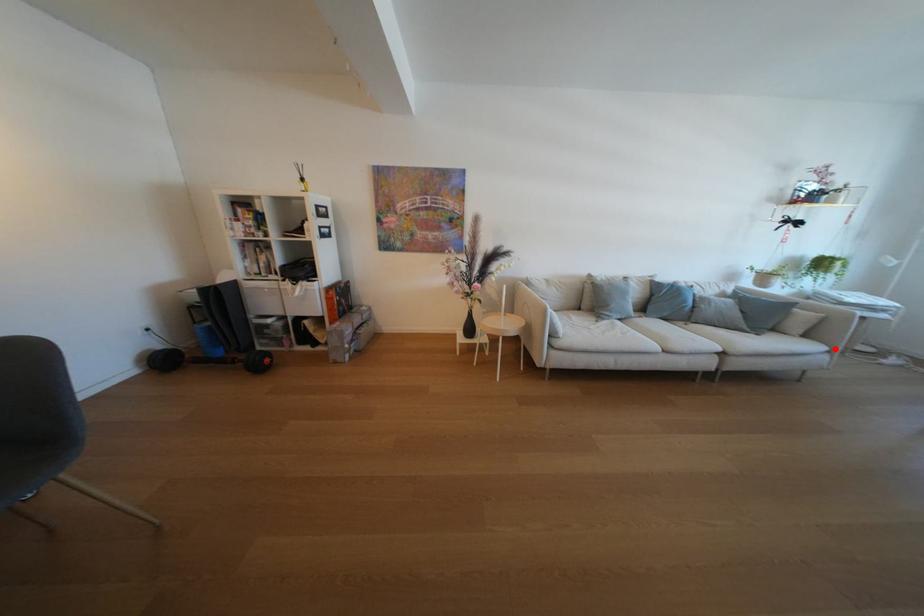
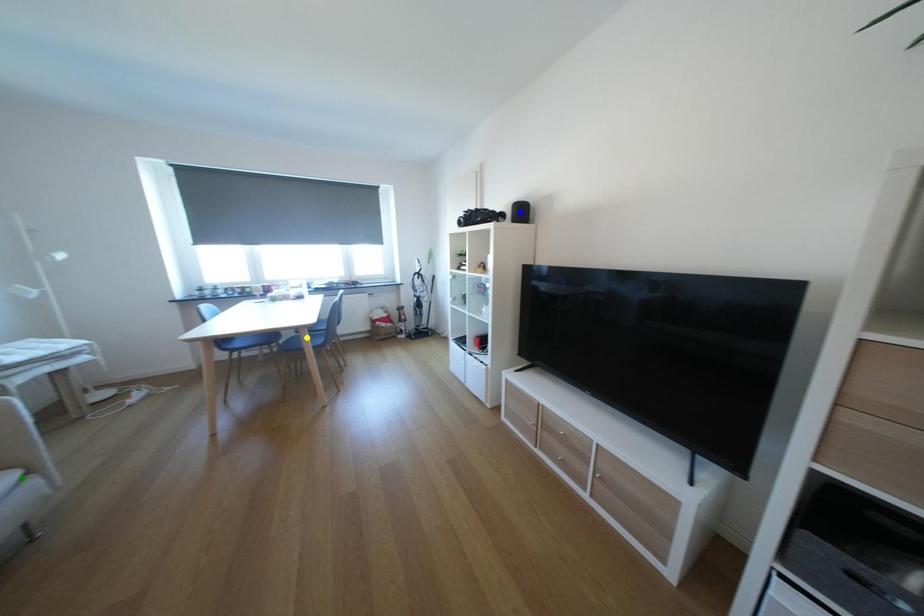
Question: I am providing you with two images of the same scene from different viewpoints. A red point is marked on the first image. You are given multiple points on the second image. In image 2, which mark is for the same physical point as the one in image 1?

Choices:
 (A) blue point
 (B) green point
 (C) yellow point

Answer: (B)